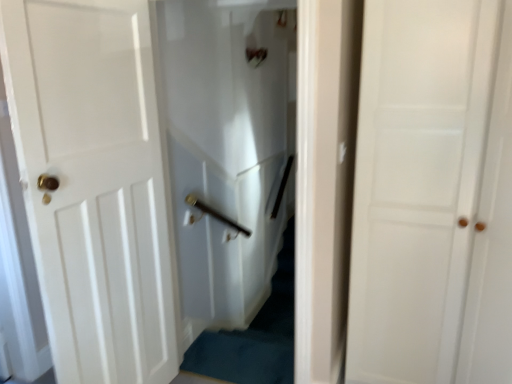
Question: Would you say white glossy door at left, which appears as the 1th door when viewed from the left, is to the left or to the right of white matte door at center, the 1th door in the right-to-left sequence, in the picture?

Choices:
 (A) left
 (B) right

Answer: (A)

Question: Is white glossy door at left, which appears as the 1th door when viewed from the left, inside or outside of white matte door at center, the 1th door in the right-to-left sequence?

Choices:
 (A) inside
 (B) outside

Answer: (B)

Question: Estimate the real-world distances between objects in this image. Which object is farther from the white glossy door at left, which appears as the 1th door when viewed from the left?

Choices:
 (A) white glossy elevator at center
 (B) white matte door at center, the 1th door in the right-to-left sequence

Answer: (B)

Question: Which object is the closest to the white glossy elevator at center?

Choices:
 (A) white matte door at center, which appears as the second door when viewed from the left
 (B) white glossy door at left, the 2th door positioned from the right

Answer: (B)